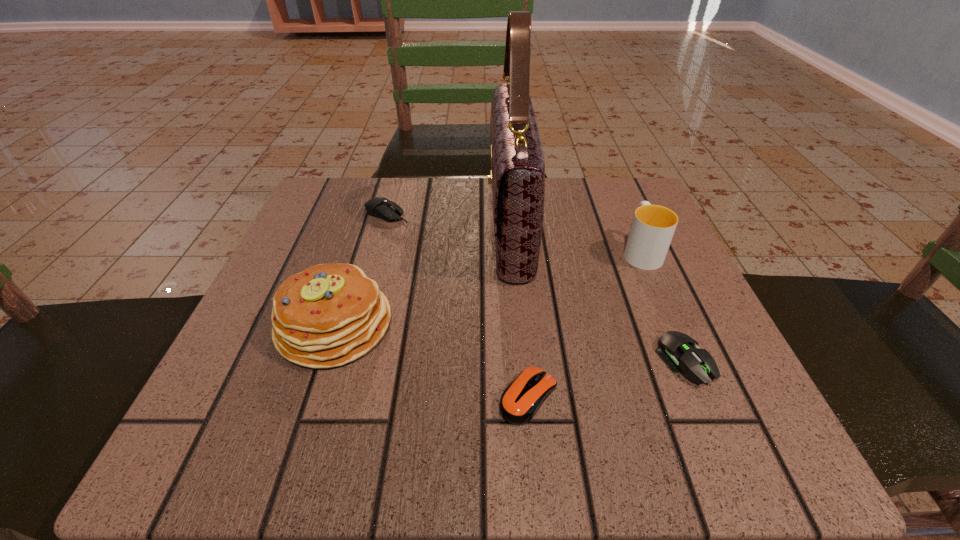
The image size is (960, 540). Identify the location of pancake that is positioned at the left edge. (328, 315).

At what (x,y) coordinates should I click in order to perform the action: click on computer mouse present at the left edge. Please return your answer as a coordinate pair (x, y). This screenshot has width=960, height=540. Looking at the image, I should click on (383, 208).

This screenshot has height=540, width=960. Identify the location of cup present at the right edge. (653, 226).

Where is `computer mouse that is at the right edge`? computer mouse that is at the right edge is located at coordinates (675, 348).

Where is `object positioned at the far left corner`? Image resolution: width=960 pixels, height=540 pixels. object positioned at the far left corner is located at coordinates (383, 208).

This screenshot has height=540, width=960. In order to click on object that is at the far right corner in this screenshot , I will do `click(653, 226)`.

The image size is (960, 540). What are the coordinates of `free space at the far edge of the desktop` in the screenshot? It's located at (399, 220).

This screenshot has width=960, height=540. In order to click on vacant region at the near edge of the desktop in this screenshot , I will do `click(481, 412)`.

I want to click on free region at the left edge of the desktop, so click(x=349, y=251).

Image resolution: width=960 pixels, height=540 pixels. Identify the location of free space at the right edge of the desktop. (676, 315).